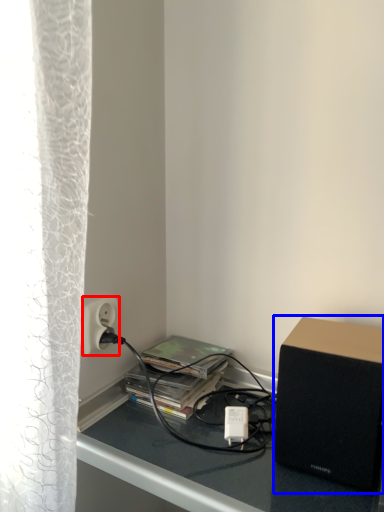
Question: Among these objects, which one is farthest to the camera, power outlet (highlighted by a red box) or loudspeaker (highlighted by a blue box)?

Choices:
 (A) power outlet
 (B) loudspeaker

Answer: (A)